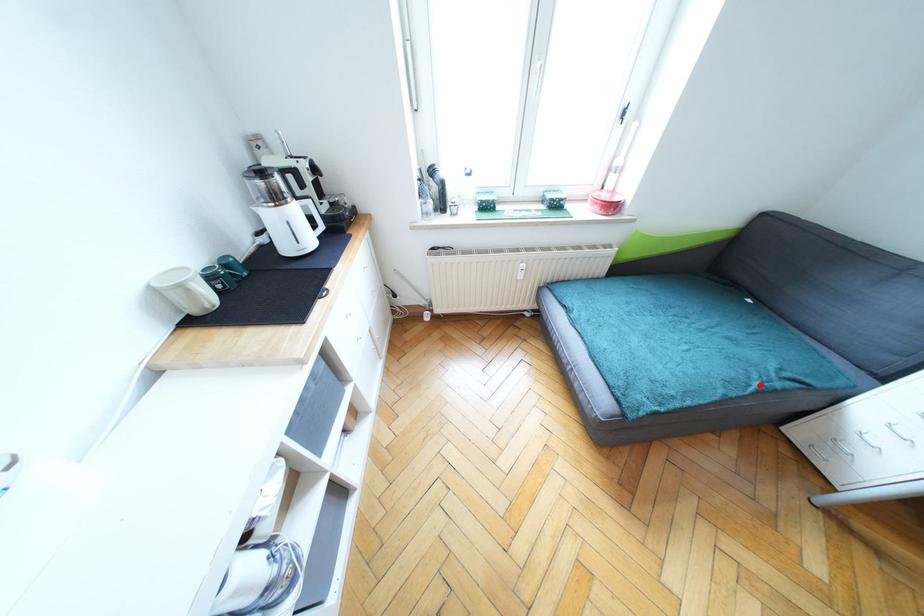
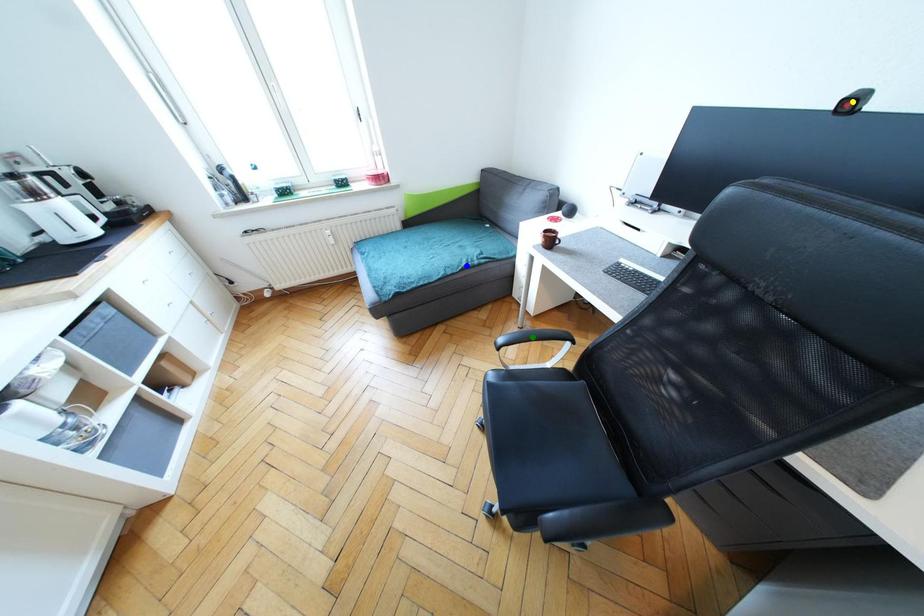
Question: I am providing you with two images of the same scene from different viewpoints. A red point is marked on the first image. You are given multiple points on the second image. Which mark in image 2 goes with the point in image 1?

Choices:
 (A) green point
 (B) blue point
 (C) yellow point

Answer: (B)